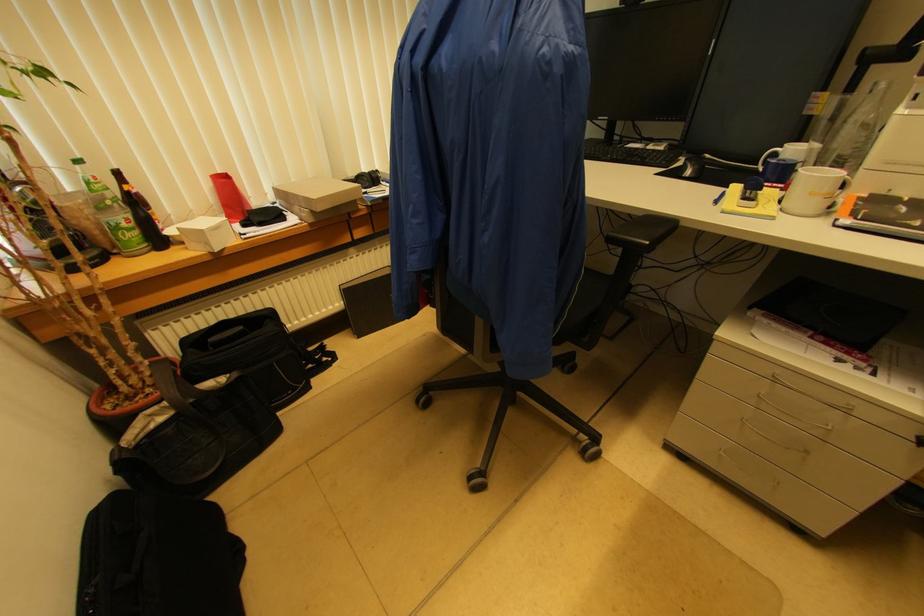
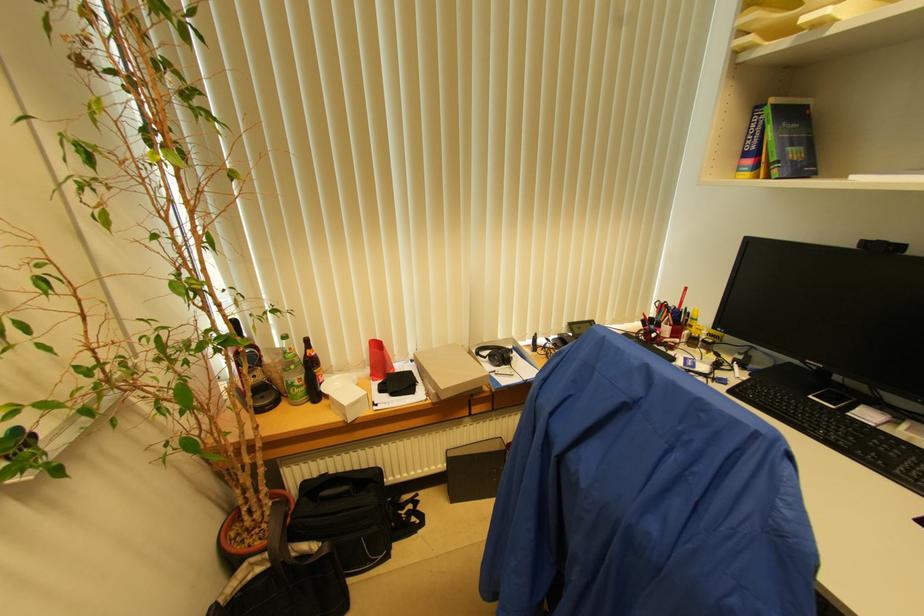
The point at (x=373, y=177) is marked in the first image. Where is the corresponding point in the second image?

(506, 358)